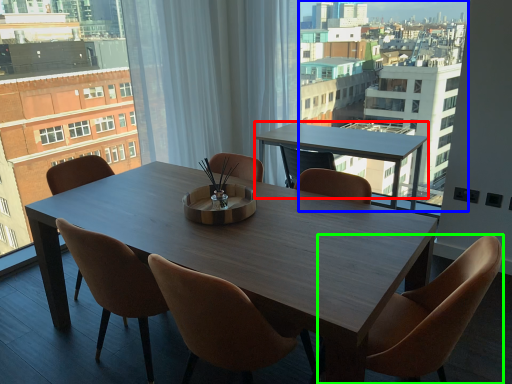
Question: Considering the real-world distances, which object is closest to coffee table (highlighted by a red box)? condominium (highlighted by a blue box) or chair (highlighted by a green box).

Choices:
 (A) condominium
 (B) chair

Answer: (A)